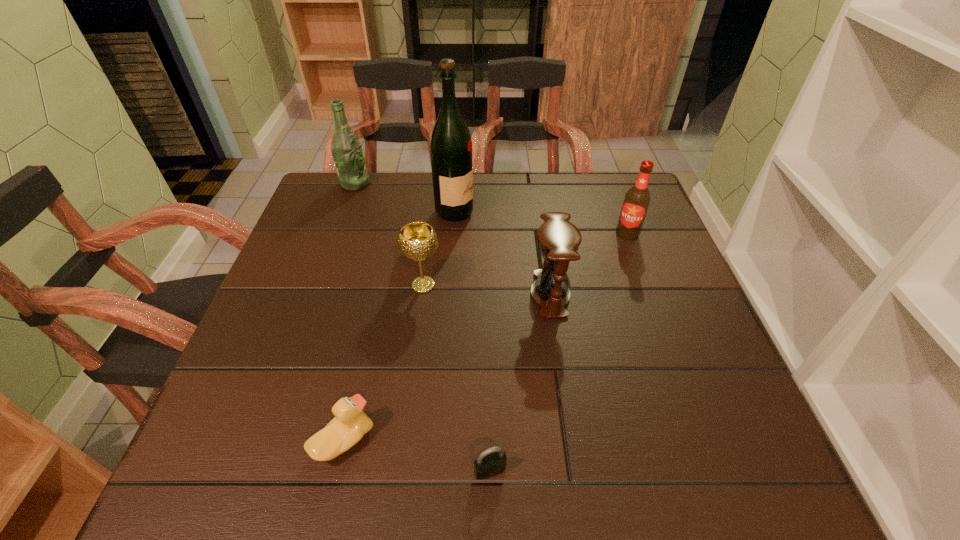
Identify the location of vacant space at the far left corner. The height and width of the screenshot is (540, 960). (369, 204).

Identify the location of vacant space at the near left corner of the desktop. Image resolution: width=960 pixels, height=540 pixels. (261, 456).

You are a GUI agent. You are given a task and a screenshot of the screen. Output one action in this format:
    pyautogui.click(x=<x>, y=<y>)
    Task: Click on the vacant position at the far right corner of the desktop
    Image resolution: width=960 pixels, height=540 pixels.
    Given the screenshot: What is the action you would take?
    pyautogui.click(x=622, y=179)

I want to click on blank region between the chalice and the shortest object, so click(457, 378).

The height and width of the screenshot is (540, 960). In order to click on unoccupied area between the hourglass and the duck in this screenshot , I will do `click(447, 367)`.

Where is `free space between the sixth object from left to right and the shortest object`? This screenshot has height=540, width=960. free space between the sixth object from left to right and the shortest object is located at coordinates (520, 382).

Identify the location of unoccupied area between the hourglass and the sixth nearest object. Image resolution: width=960 pixels, height=540 pixels. point(502,253).

Image resolution: width=960 pixels, height=540 pixels. I want to click on blank region between the hourglass and the sixth nearest object, so click(x=502, y=253).

Image resolution: width=960 pixels, height=540 pixels. Find the location of `free area in between the second shortest object and the chalice`. free area in between the second shortest object and the chalice is located at coordinates (384, 363).

Find the location of `empty space that is in between the chalice and the hourglass`. empty space that is in between the chalice and the hourglass is located at coordinates (487, 289).